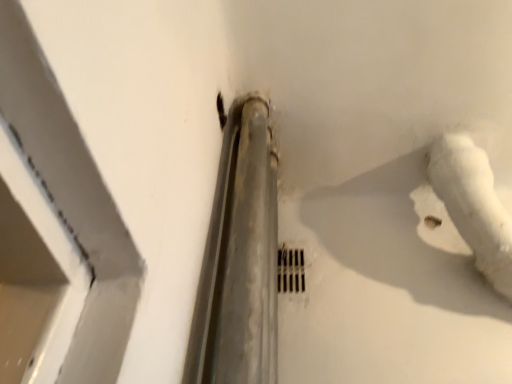
Question: From the image's perspective, is white matte water pipe at center-right positioned above or below metallic grid at center?

Choices:
 (A) above
 (B) below

Answer: (A)

Question: Is white matte water pipe at center-right taller or shorter than metallic grid at center?

Choices:
 (A) tall
 (B) short

Answer: (A)

Question: Is white matte water pipe at center-right bigger or smaller than metallic grid at center?

Choices:
 (A) small
 (B) big

Answer: (B)

Question: From a real-world perspective, relative to white matte water pipe at center-right, is metallic grid at center vertically above or below?

Choices:
 (A) below
 (B) above

Answer: (A)

Question: Is metallic grid at center wider or thinner than white matte water pipe at center-right?

Choices:
 (A) wide
 (B) thin

Answer: (B)

Question: Considering the positions of metallic grid at center and white matte water pipe at center-right in the image, is metallic grid at center bigger or smaller than white matte water pipe at center-right?

Choices:
 (A) big
 (B) small

Answer: (B)

Question: Considering the positions of point (287, 284) and point (464, 157), is point (287, 284) closer or farther from the camera than point (464, 157)?

Choices:
 (A) closer
 (B) farther

Answer: (B)